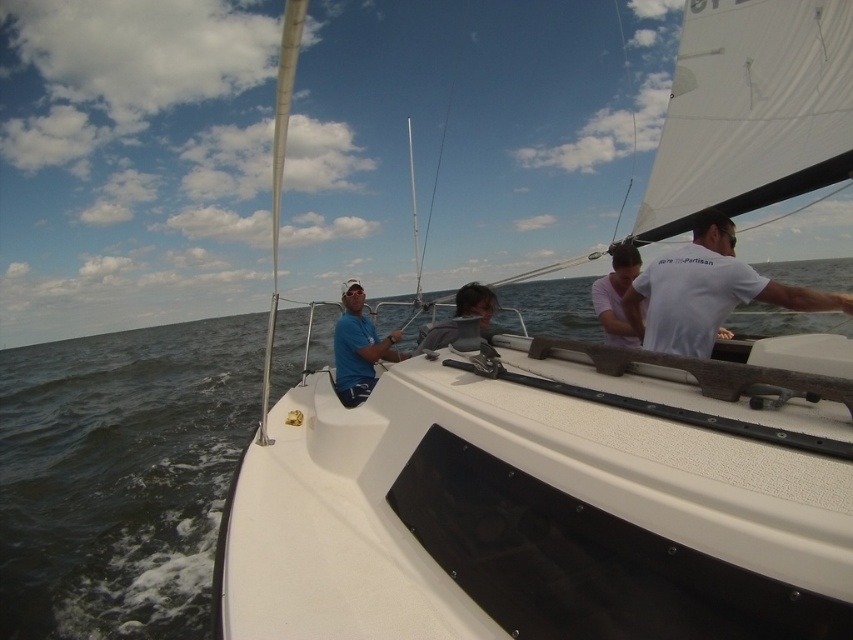
Question: Which point is farther from the camera taking this photo?

Choices:
 (A) (384, 356)
 (B) (445, 332)
 (C) (622, 280)

Answer: (A)

Question: Observing the image, what is the correct spatial positioning of dark blue water at center in reference to matte blue shirt at center?

Choices:
 (A) left
 (B) right

Answer: (A)

Question: Which object appears farthest from the camera in this image?

Choices:
 (A) dark blue water at center
 (B) gray fabric jacket at center

Answer: (A)

Question: Based on their relative distances, which object is farther from the pink matte shirt at center?

Choices:
 (A) gray fabric jacket at center
 (B) white cotton shirt at right

Answer: (A)

Question: Is matte blue shirt at center below gray fabric jacket at center?

Choices:
 (A) yes
 (B) no

Answer: (A)

Question: Does dark blue water at center have a greater width compared to gray fabric jacket at center?

Choices:
 (A) no
 (B) yes

Answer: (B)